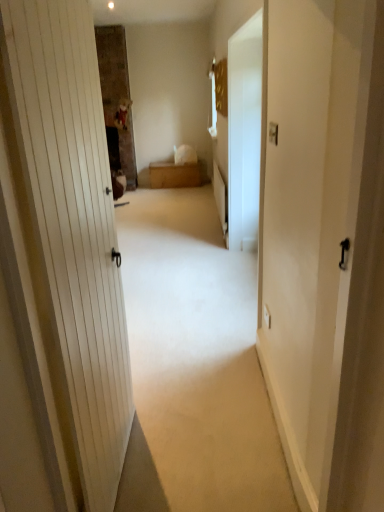
Question: Does point (205, 487) appear closer or farther from the camera than point (238, 132)?

Choices:
 (A) closer
 (B) farther

Answer: (A)

Question: From the image's perspective, is white matte door at center positioned above or below white glossy screen door at center?

Choices:
 (A) below
 (B) above

Answer: (A)

Question: Estimate the real-world distances between objects in this image. Which object is farther from the white matte door at center?

Choices:
 (A) wooden chest at center
 (B) white glossy screen door at center

Answer: (A)

Question: Which of these objects is positioned farthest from the wooden chest at center?

Choices:
 (A) white glossy screen door at center
 (B) white matte door at center

Answer: (B)